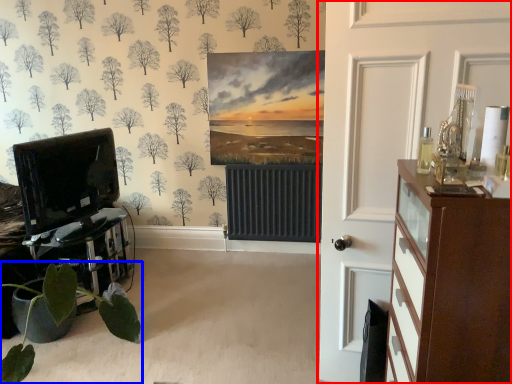
Question: Which object appears farthest to the camera in this image, door (highlighted by a red box) or houseplant (highlighted by a blue box)?

Choices:
 (A) door
 (B) houseplant

Answer: (B)